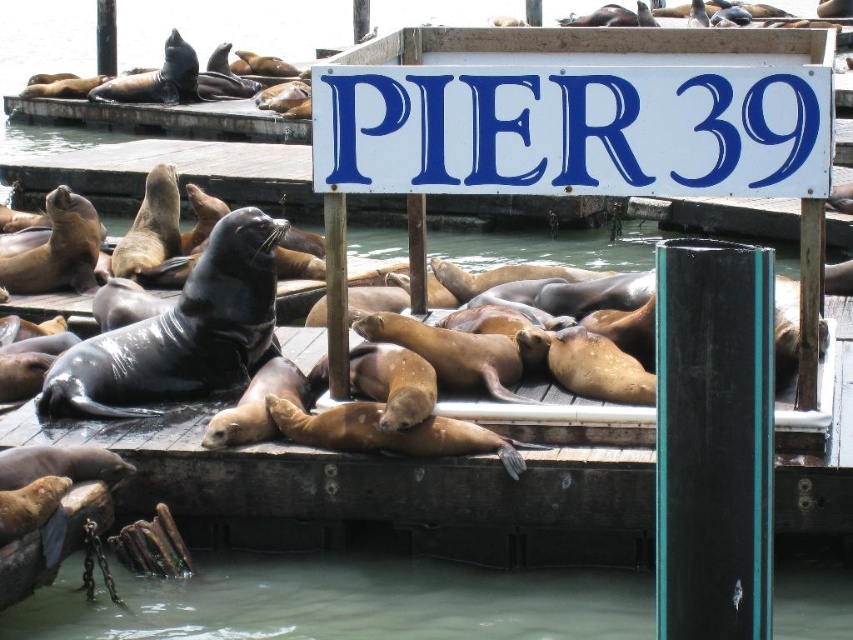
Is point (463, 32) more distant than point (367, 609)?

Yes, point (463, 32) is farther from viewer.

Who is positioned more to the right, white painted wood sign at center or greenish murky water at lower center?

Positioned to the right is white painted wood sign at center.

Is point (553, 42) more distant than point (160, 627)?

Yes, point (553, 42) is farther from viewer.

Locate an element on the screen. This screenshot has width=853, height=640. white painted wood sign at center is located at coordinates (578, 116).